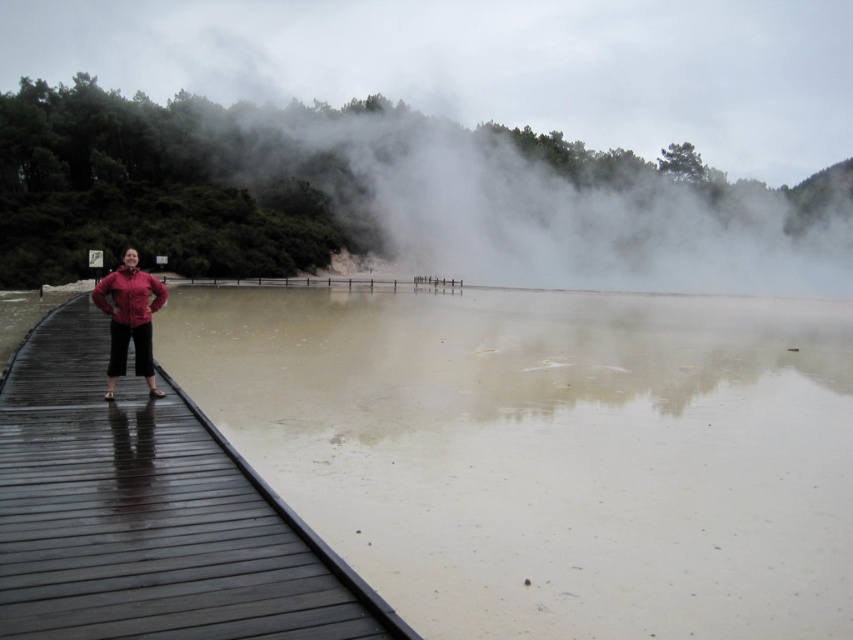
You are a photographer trying to capture the person in the matte red jacket at center and the matte red jacket at left. Which jacket appears larger in your photo?

The matte red jacket at center appears larger because it is closer to the viewer than the matte red jacket at left.

You are a photographer standing at the edge of the wooden boardwalk in the scene. You want to take a photo that includes both the point at coordinates point [695,403] and point [126,268]. Since you want both points to be in focus, you need to adjust your camera settings. Which point is closer to the camera so you can set the focus accordingly?

Point [126,268] is closer to the camera than point [695,403], so you should set the focus on point [126,268] to ensure both are in focus.